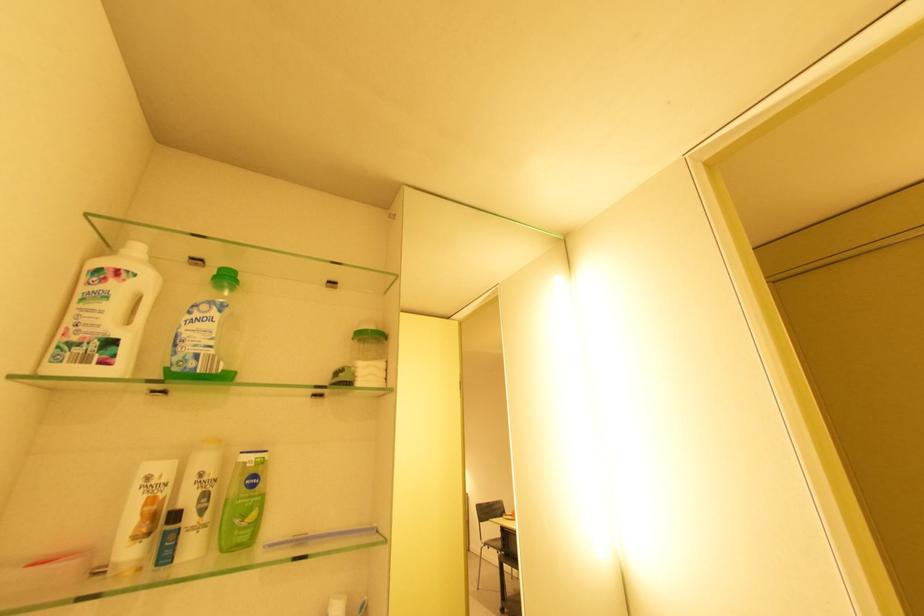
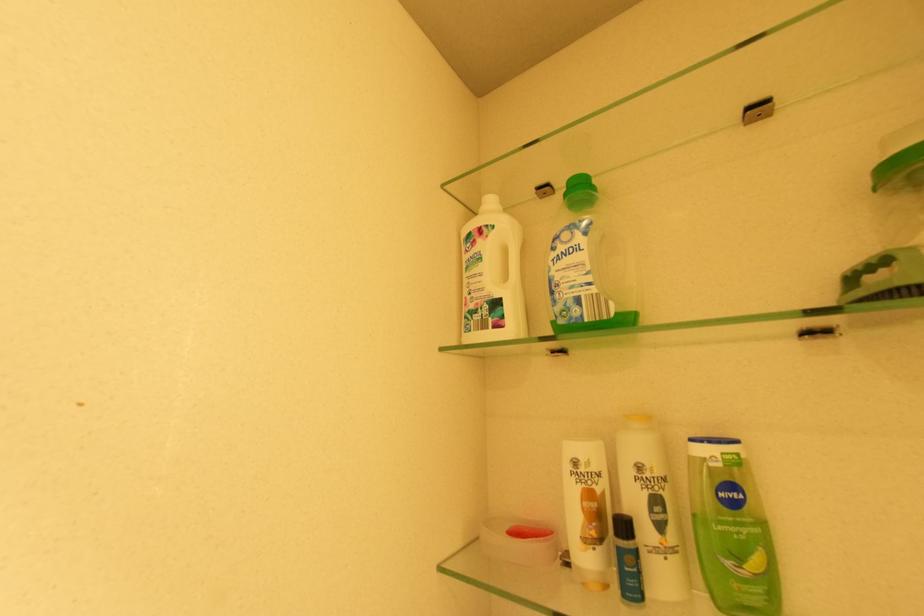
Question: Based on the continuous images, in which direction is the camera rotating? Reply with the corresponding letter.

Choices:
 (A) Left
 (B) Right
 (C) Up
 (D) Down

Answer: (A)